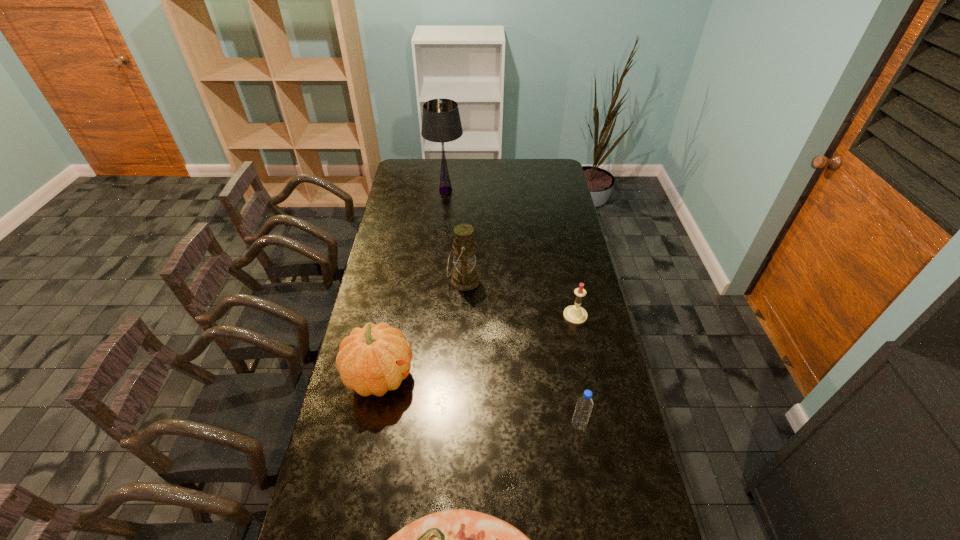
At what (x,y) coordinates should I click in order to perform the action: click on vacant region located on the front of the candle. Please return your answer as a coordinate pair (x, y). Looking at the image, I should click on (589, 383).

At what (x,y) coordinates should I click in order to perform the action: click on object at the far edge. Please return your answer as a coordinate pair (x, y). Image resolution: width=960 pixels, height=540 pixels. Looking at the image, I should click on (441, 122).

This screenshot has height=540, width=960. What are the coordinates of `object that is at the left edge` in the screenshot? It's located at (374, 359).

The image size is (960, 540). I want to click on water bottle that is at the right edge, so click(584, 406).

Find the location of a particular element. candle that is positioned at the right edge is located at coordinates (575, 314).

In the image, there is a desktop. Identify the location of vacant space at the far edge. (504, 173).

The height and width of the screenshot is (540, 960). In the image, there is a desktop. What are the coordinates of `free space at the left edge` in the screenshot? It's located at (378, 320).

The image size is (960, 540). In the image, there is a desktop. Find the location of `vacant space at the right edge`. vacant space at the right edge is located at coordinates (559, 239).

You are a GUI agent. You are given a task and a screenshot of the screen. Output one action in this format:
    pyautogui.click(x=<x>, y=<y>)
    Task: Click on the free space between the water bottle and the oil lamp
    
    Given the screenshot: What is the action you would take?
    pyautogui.click(x=521, y=353)

This screenshot has width=960, height=540. I want to click on free area in between the oil lamp and the fourth nearest object, so click(519, 298).